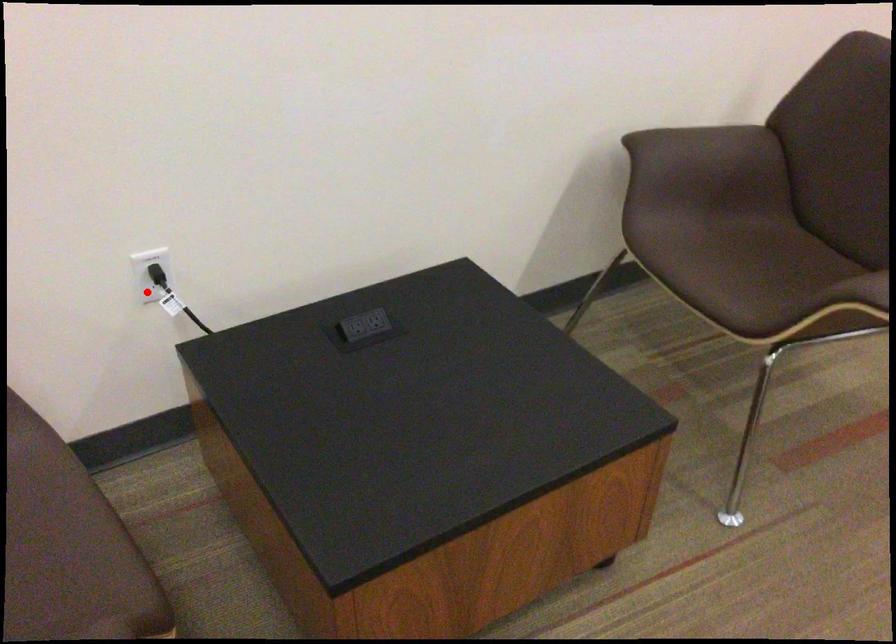
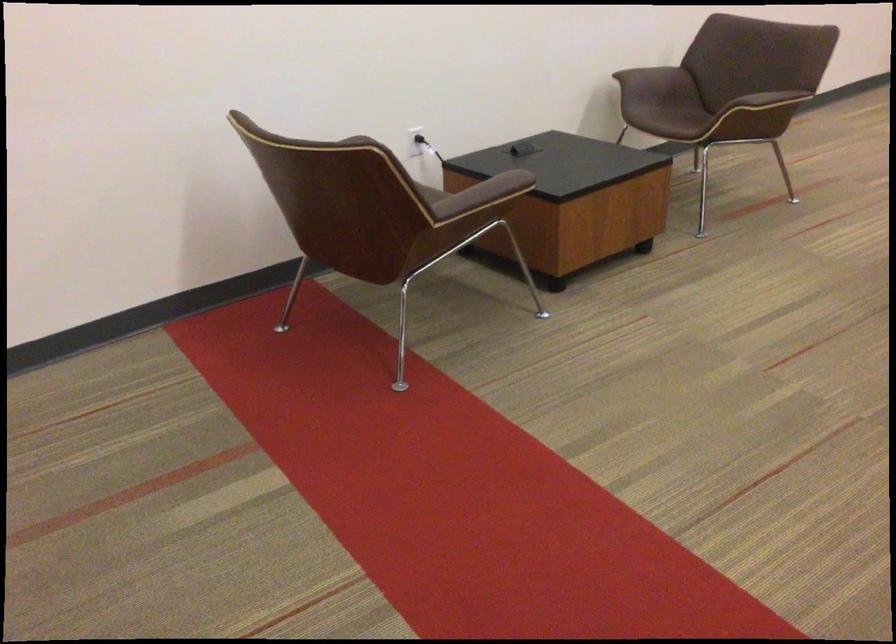
Question: A red point is marked in image1. In image2, is the corresponding 3D point closer to the camera or farther? Reply with the corresponding letter.

Choices:
 (A) The corresponding 3D point is closer.
 (B) The corresponding 3D point is farther.

Answer: (B)